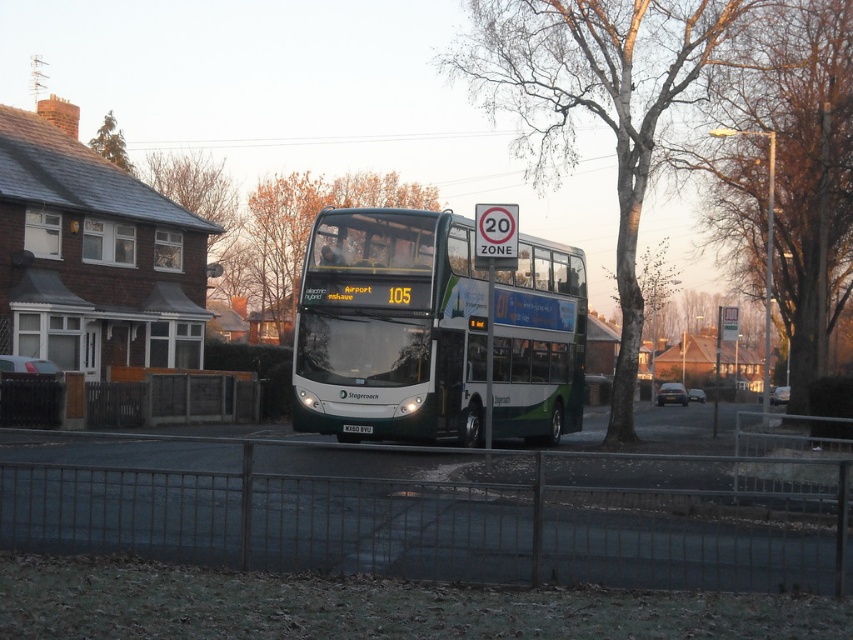
You are standing at the fence and want to walk to the bus. Which point, point (x=410, y=422) or point (x=349, y=180), is closer to you?

Point (x=410, y=422) is closer to you than point (x=349, y=180).